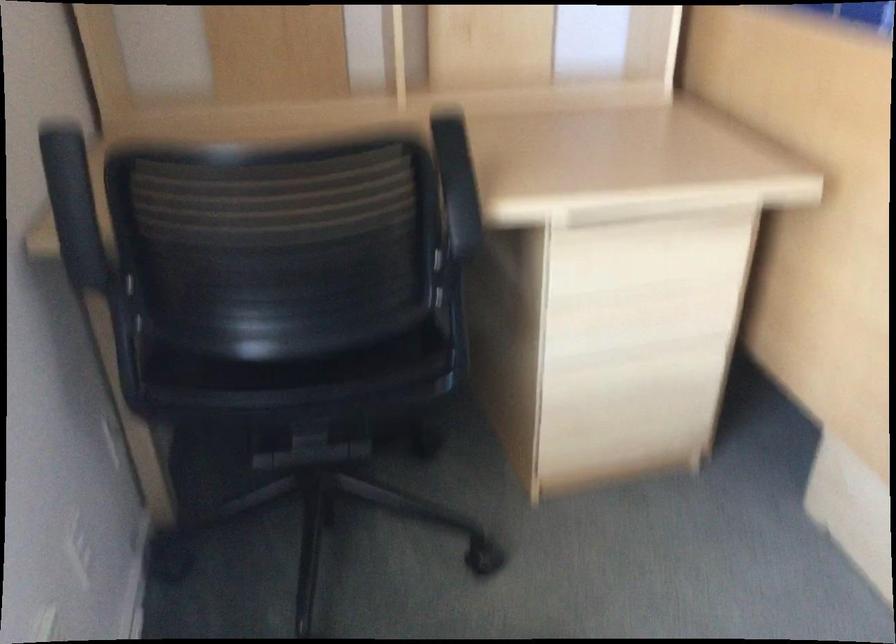
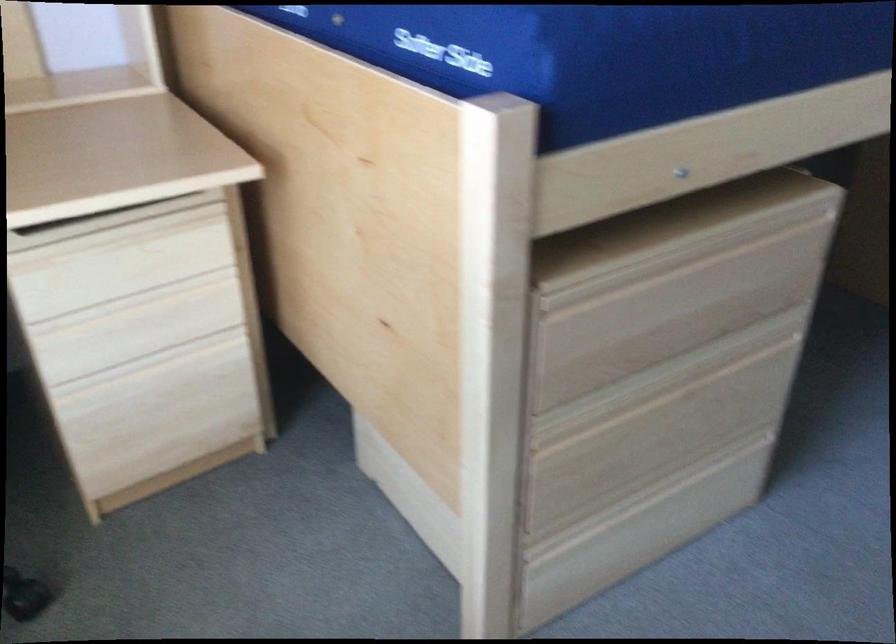
Question: How did the camera likely rotate?

Choices:
 (A) Left
 (B) Right
 (C) Up
 (D) Down

Answer: (B)